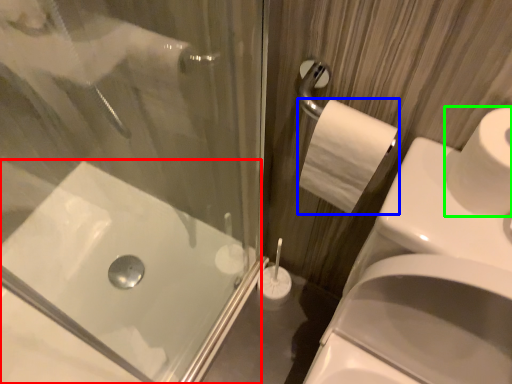
Question: Based on their relative distances, which object is nearer to bath (highlighted by a red box)? Choose from toilet paper (highlighted by a blue box) and toilet paper (highlighted by a green box).

Choices:
 (A) toilet paper
 (B) toilet paper

Answer: (A)